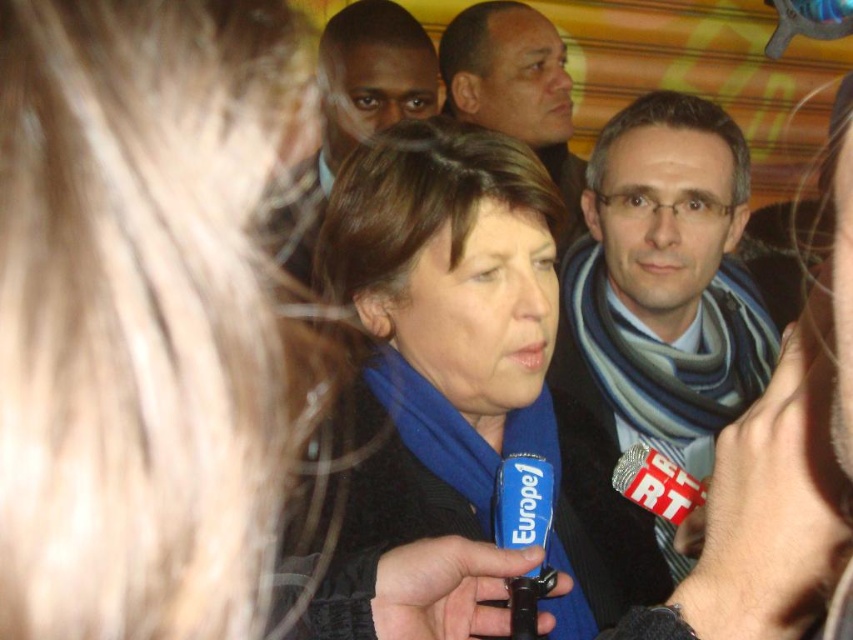
Question: Which of the following is the closest to the observer?

Choices:
 (A) dark brown hair at upper left
 (B) striped scarf at center
 (C) blue fabric scarf at center

Answer: (C)

Question: Based on their relative distances, which object is nearer to the blue fabric scarf at center?

Choices:
 (A) dark brown hair at upper left
 (B) smooth brown leather jacket at upper center

Answer: (B)

Question: Does dark brown hair at upper left appear under smooth brown leather jacket at upper center?

Choices:
 (A) yes
 (B) no

Answer: (B)

Question: In this image, where is striped scarf at center located relative to dark brown hair at upper left?

Choices:
 (A) above
 (B) below

Answer: (B)

Question: Among these objects, which one is nearest to the camera?

Choices:
 (A) smooth brown leather jacket at upper center
 (B) striped scarf at center

Answer: (B)

Question: Is striped scarf at center to the left of dark brown hair at upper left from the viewer's perspective?

Choices:
 (A) no
 (B) yes

Answer: (A)